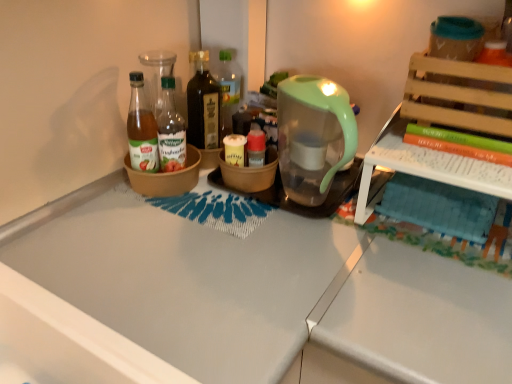
You are a GUI agent. You are given a task and a screenshot of the screen. Output one action in this format:
    pyautogui.click(x=<x>, y=<y>)
    Task: Click on the free space in front of dark brown glass bottle at center, placed as the 2th bottle when sorted from left to right
    The width and height of the screenshot is (512, 384).
    Given the screenshot: What is the action you would take?
    pyautogui.click(x=221, y=201)